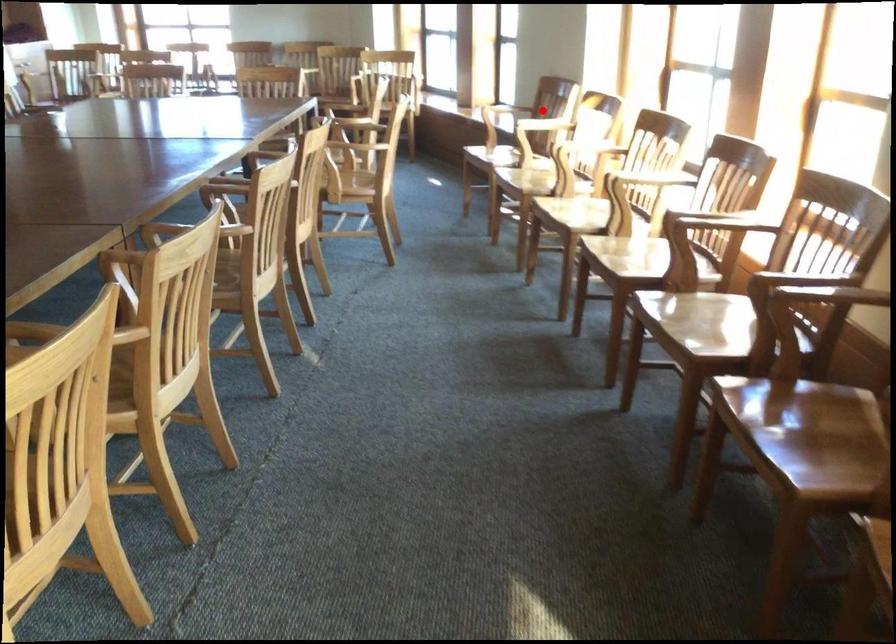
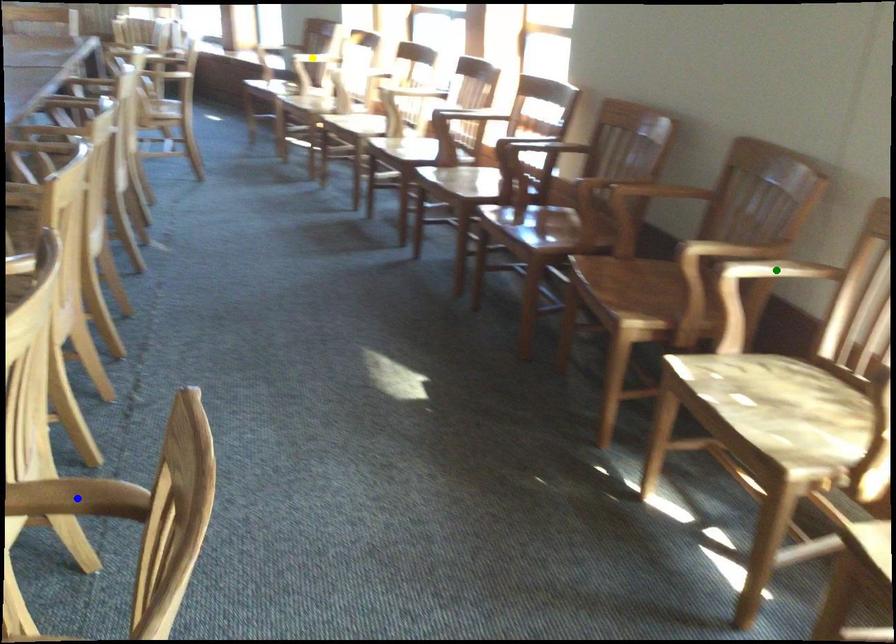
Question: I am providing you with two images of the same scene from different viewpoints. A red point is marked on the first image. You are given multiple points on the second image. In image 2, which mark is for the same physical point as the one in image 1?

Choices:
 (A) blue point
 (B) green point
 (C) yellow point

Answer: (C)